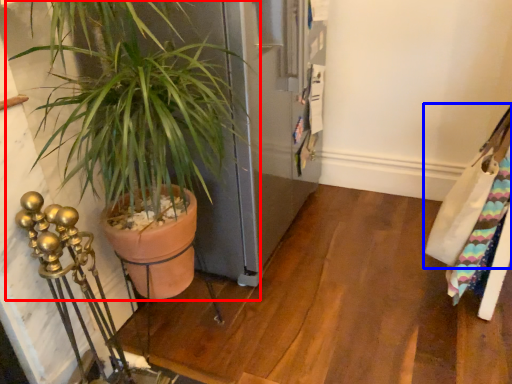
Question: Among these objects, which one is nearest to the camera, houseplant (highlighted by a red box) or messenger bag (highlighted by a blue box)?

Choices:
 (A) houseplant
 (B) messenger bag

Answer: (A)